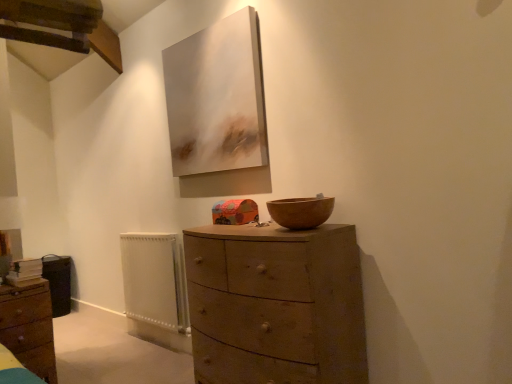
Question: Is matte brown chest of drawers at lower left, arranged as the first chest of drawers when viewed from the left, at the right side of wooden chest of drawers at center, placed as the 2th chest of drawers when sorted from left to right?

Choices:
 (A) yes
 (B) no

Answer: (B)

Question: Does matte brown chest of drawers at lower left, which ranks as the 2th chest of drawers in right-to-left order, have a greater height compared to wooden chest of drawers at center, placed as the 2th chest of drawers when sorted from left to right?

Choices:
 (A) no
 (B) yes

Answer: (A)

Question: From a real-world perspective, is matte brown chest of drawers at lower left, which ranks as the 2th chest of drawers in right-to-left order, under wooden chest of drawers at center, the first chest of drawers in the right-to-left sequence?

Choices:
 (A) no
 (B) yes

Answer: (B)

Question: Can you confirm if matte brown chest of drawers at lower left, which ranks as the 2th chest of drawers in right-to-left order, is shorter than wooden chest of drawers at center, the first chest of drawers in the right-to-left sequence?

Choices:
 (A) yes
 (B) no

Answer: (A)

Question: Does matte brown chest of drawers at lower left, arranged as the first chest of drawers when viewed from the left, have a greater width compared to wooden chest of drawers at center, the first chest of drawers in the right-to-left sequence?

Choices:
 (A) no
 (B) yes

Answer: (A)

Question: Is matte brown chest of drawers at lower left, arranged as the first chest of drawers when viewed from the left, further to the viewer compared to wooden chest of drawers at center, placed as the 2th chest of drawers when sorted from left to right?

Choices:
 (A) no
 (B) yes

Answer: (B)

Question: Is wooden bowl at center completely or partially inside wooden chest of drawers at center, the first chest of drawers in the right-to-left sequence?

Choices:
 (A) yes
 (B) no

Answer: (B)

Question: From the image's perspective, does wooden chest of drawers at center, placed as the 2th chest of drawers when sorted from left to right, appear lower than wooden bowl at center?

Choices:
 (A) no
 (B) yes

Answer: (B)

Question: From the image's perspective, does wooden chest of drawers at center, placed as the 2th chest of drawers when sorted from left to right, appear higher than wooden bowl at center?

Choices:
 (A) yes
 (B) no

Answer: (B)

Question: Is wooden chest of drawers at center, the first chest of drawers in the right-to-left sequence, taller than wooden bowl at center?

Choices:
 (A) yes
 (B) no

Answer: (A)

Question: Is wooden chest of drawers at center, the first chest of drawers in the right-to-left sequence, looking in the opposite direction of wooden bowl at center?

Choices:
 (A) no
 (B) yes

Answer: (A)

Question: Is wooden chest of drawers at center, the first chest of drawers in the right-to-left sequence, aimed at wooden bowl at center?

Choices:
 (A) yes
 (B) no

Answer: (B)

Question: Is wooden bowl at center not near white painted metal radiator at lower left?

Choices:
 (A) yes
 (B) no

Answer: (A)